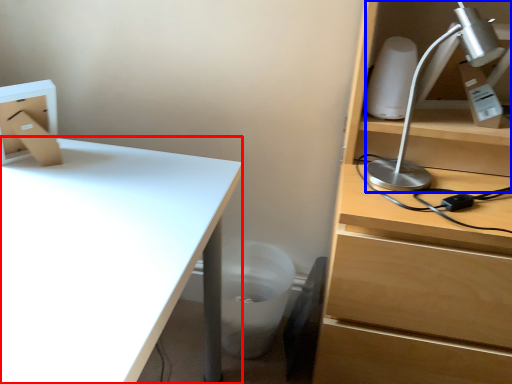
Question: Which of the following is the closest to the observer, desk (highlighted by a red box) or lamp (highlighted by a blue box)?

Choices:
 (A) desk
 (B) lamp

Answer: (A)